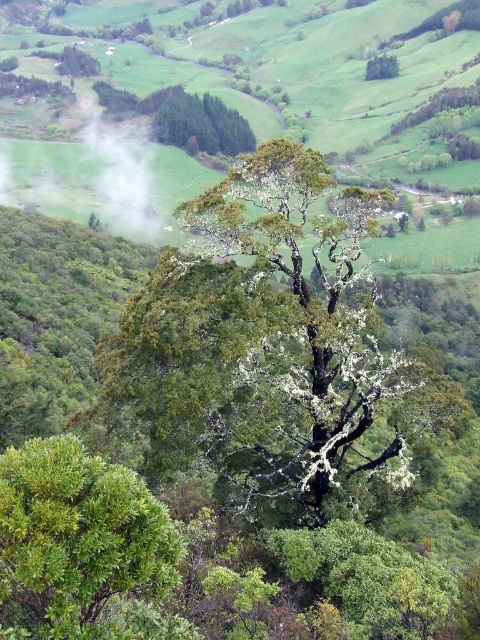
Who is taller, green lichen-covered tree at center or green lichen-covered tree at upper center?

Standing taller between the two is green lichen-covered tree at center.

Measure the distance between green lichen-covered tree at center and green lichen-covered tree at upper center.

green lichen-covered tree at center and green lichen-covered tree at upper center are 527.02 meters apart.

Locate an element on the screen. This screenshot has height=640, width=480. green lichen-covered tree at center is located at coordinates (302, 339).

Is green leafy bush at lower left wider than green lichen-covered tree at upper center?

No.

The image size is (480, 640). In order to click on green leafy bush at lower left in this screenshot , I will do pyautogui.click(x=83, y=547).

Is green leafy tree at upper center shorter than green lichen-covered tree at upper center?

Incorrect, green leafy tree at upper center's height does not fall short of green lichen-covered tree at upper center's.

Is green leafy tree at upper center below green lichen-covered tree at upper center?

Yes, green leafy tree at upper center is below green lichen-covered tree at upper center.

Is point (183, 125) less distant than point (389, 64)?

Yes, point (183, 125) is in front of point (389, 64).

Find the location of a particular element. The width and height of the screenshot is (480, 640). green leafy tree at upper center is located at coordinates (202, 124).